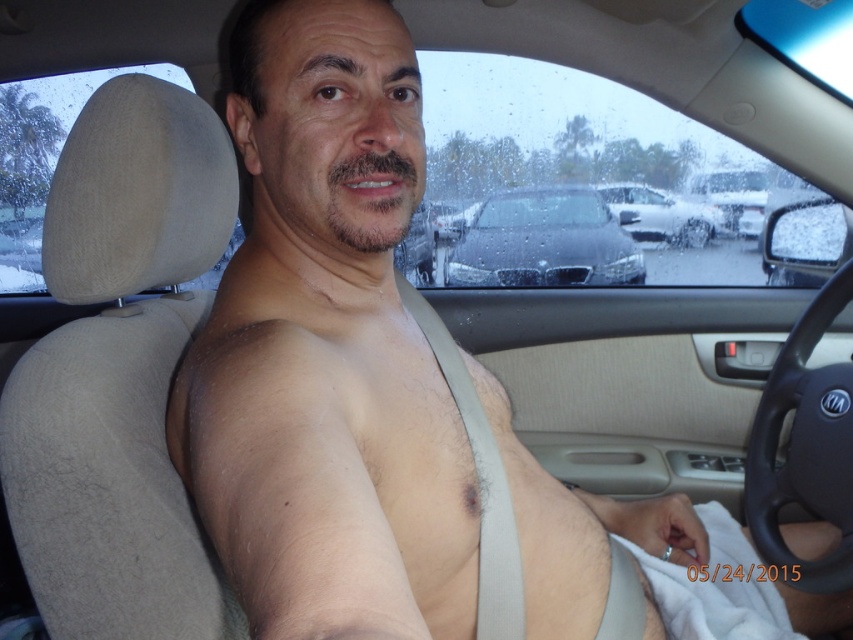
Who is shorter, black metallic car at center or white fabric at lower right?

With less height is white fabric at lower right.

Does black metallic car at center have a lesser width compared to white fabric at lower right?

In fact, black metallic car at center might be wider than white fabric at lower right.

Which is in front, point (485, 269) or point (752, 608)?

Point (752, 608)

Image resolution: width=853 pixels, height=640 pixels. I want to click on black metallic car at center, so click(544, 241).

Who is positioned more to the right, white fabric at lower right or silver metallic sedan at center?

silver metallic sedan at center

This screenshot has height=640, width=853. Identify the location of white fabric at lower right. (715, 588).

Image resolution: width=853 pixels, height=640 pixels. Identify the location of white fabric at lower right. [715, 588].

Based on the photo, is black metallic car at center shorter than silver metallic sedan at center?

In fact, black metallic car at center may be taller than silver metallic sedan at center.

Can you confirm if black metallic car at center is positioned to the left of silver metallic sedan at center?

Yes, black metallic car at center is to the left of silver metallic sedan at center.

Between point (601, 272) and point (720, 225), which one is positioned in front?

Point (601, 272)

The image size is (853, 640). I want to click on black metallic car at center, so click(544, 241).